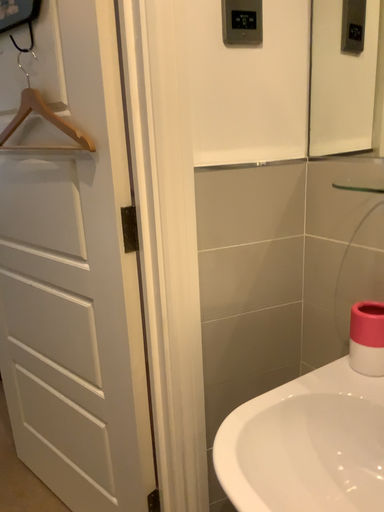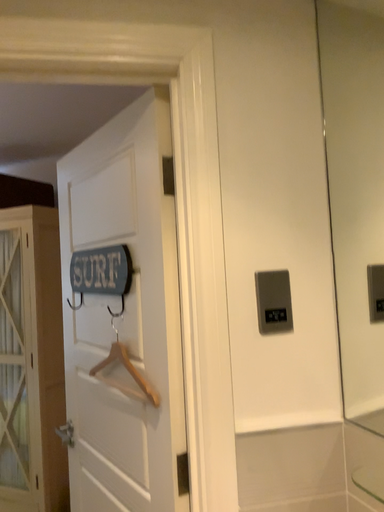
Question: How did the camera likely rotate when shooting the video?

Choices:
 (A) rotated downward
 (B) rotated upward

Answer: (B)